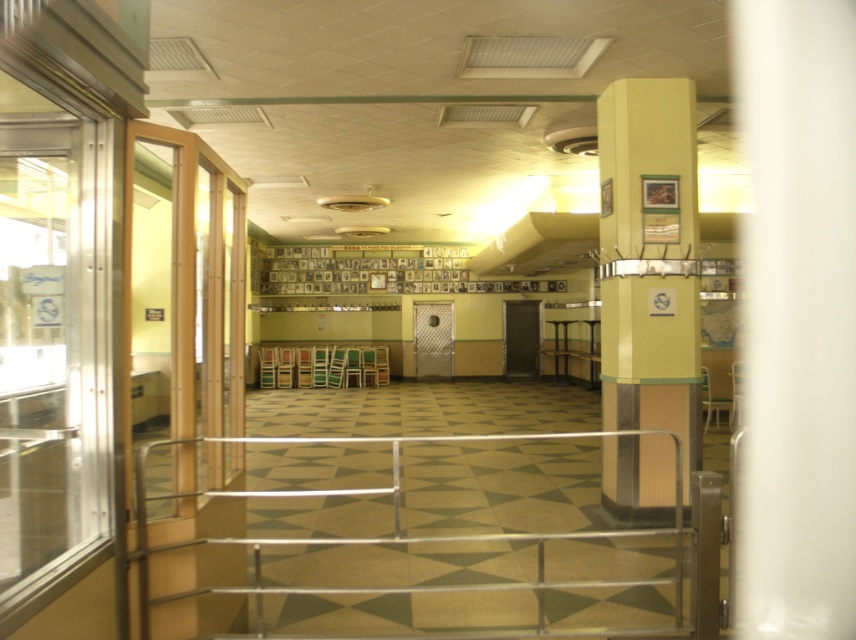
You are a maintenance worker needing to reach a tool located between the silver metallic rail at center and the yellow matte column at center. Your reach extends 3 feet. Can you comfortably access the tool without moving either object?

The distance between the silver metallic rail at center and the yellow matte column at center is 5.65 feet. Since your reach extends 3 feet, you can comfortably access the tool without needing to move either object because the distance is greater than your reach, allowing you to reach across.

Based on the photo, you are an interior designer assessing the space. You need to determine if the silver metallic rail at center can be placed on top of the yellow matte column at center without exceeding its height. Based on the provided information, is this possible?

The silver metallic rail at center is shorter than the yellow matte column at center. Therefore, the rail can be placed on top of the column since it is shorter and won not exceed the column height.